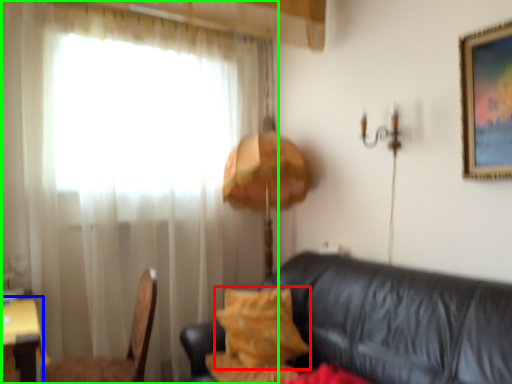
Question: Based on their relative distances, which object is farther from pillow (highlighted by a red box)? Choose from table (highlighted by a blue box) and curtain (highlighted by a green box).

Choices:
 (A) table
 (B) curtain

Answer: (A)